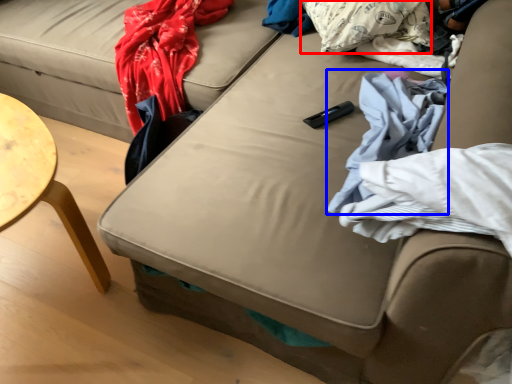
Question: Among these objects, which one is nearest to the camera, pillow (highlighted by a red box) or material (highlighted by a blue box)?

Choices:
 (A) pillow
 (B) material

Answer: (B)